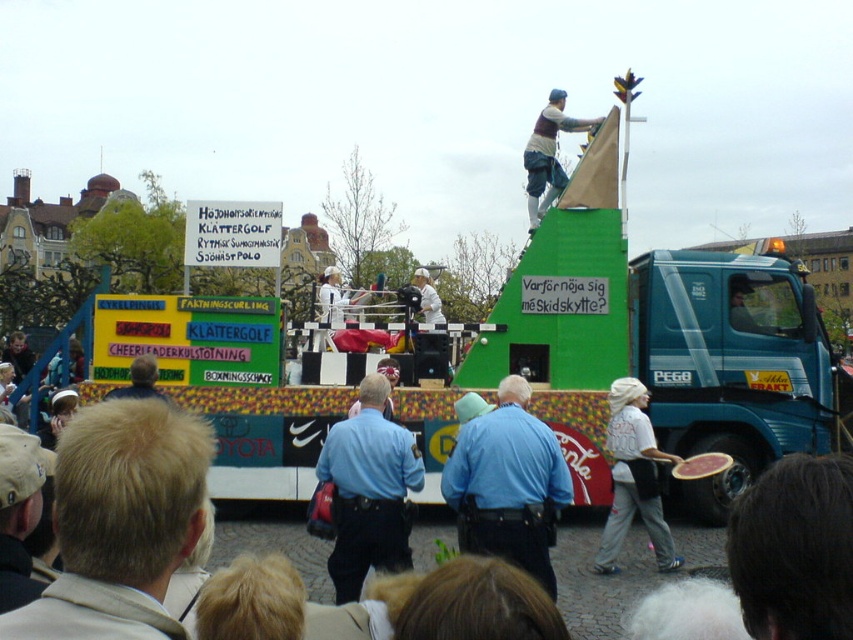
Who is taller, blue uniform shirt at center or matte brown vest at upper center?

matte brown vest at upper center is taller.

Who is more forward, (x=537, y=504) or (x=555, y=141)?

Point (x=537, y=504) is in front.

The height and width of the screenshot is (640, 853). Find the location of `blue uniform shirt at center`. blue uniform shirt at center is located at coordinates (508, 483).

Does blonde hair at center appear on the right side of blue uniform at center?

Incorrect, blonde hair at center is not on the right side of blue uniform at center.

Locate an element on the screen. The height and width of the screenshot is (640, 853). blonde hair at center is located at coordinates click(x=120, y=522).

Consider the image. Who is more distant from viewer, (169, 420) or (543, 177)?

Point (543, 177)

Which of these two, blonde hair at center or matte brown vest at upper center, stands taller?

matte brown vest at upper center is taller.

Does point (129, 616) lie in front of point (544, 189)?

Yes, it is in front of point (544, 189).

Where is `blonde hair at center`? The height and width of the screenshot is (640, 853). blonde hair at center is located at coordinates (120, 522).